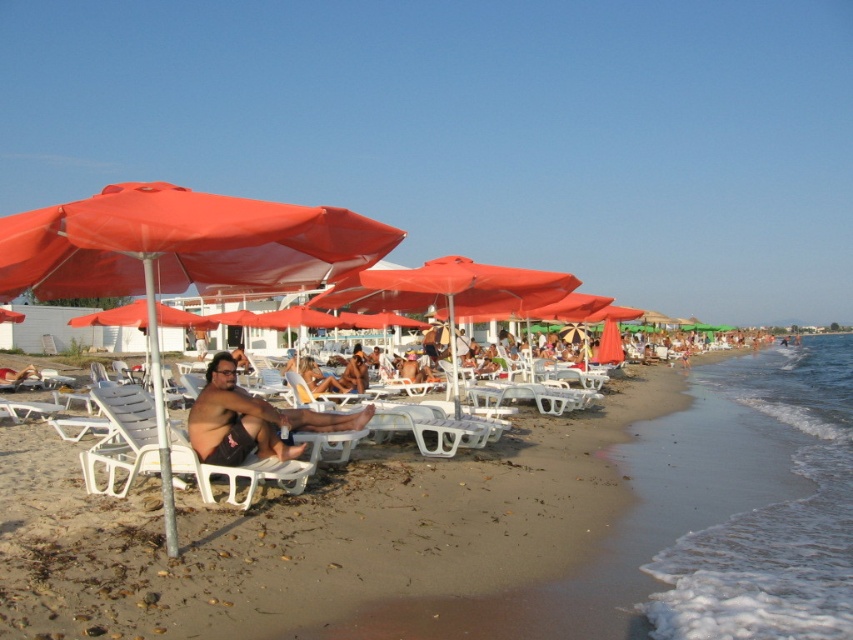
Is matte orange umbrella at left positioned in front of white plastic beach chair at lower left?

That is True.

Between matte orange umbrella at left and white plastic beach chair at lower left, which one appears on the left side from the viewer's perspective?

From the viewer's perspective, matte orange umbrella at left appears more on the left side.

Who is more forward, (x=346, y=237) or (x=132, y=461)?

Point (x=346, y=237) is in front.

Where is `matte orange umbrella at left`? matte orange umbrella at left is located at coordinates (180, 257).

Can you confirm if sandy beach at center is wider than white plastic beach chair at lower left?

Yes, sandy beach at center is wider than white plastic beach chair at lower left.

Is sandy beach at center closer to camera compared to white plastic beach chair at lower left?

Yes, it is.

Is point (354, 602) farther from viewer compared to point (106, 396)?

That is False.

You are a GUI agent. You are given a task and a screenshot of the screen. Output one action in this format:
    pyautogui.click(x=<x>, y=<y>)
    Task: Click on the sandy beach at center
    The height and width of the screenshot is (640, 853).
    Given the screenshot: What is the action you would take?
    pyautogui.click(x=389, y=525)

Measure the distance from matte orange umbrella at left to dark brown skin at center.

The distance of matte orange umbrella at left from dark brown skin at center is 1.32 meters.

Does matte orange umbrella at left have a lesser width compared to dark brown skin at center?

Incorrect, matte orange umbrella at left's width is not less than dark brown skin at center's.

Is point (149, 364) farther from viewer compared to point (241, 406)?

That is True.

Where is `matte orange umbrella at left`? matte orange umbrella at left is located at coordinates (180, 257).